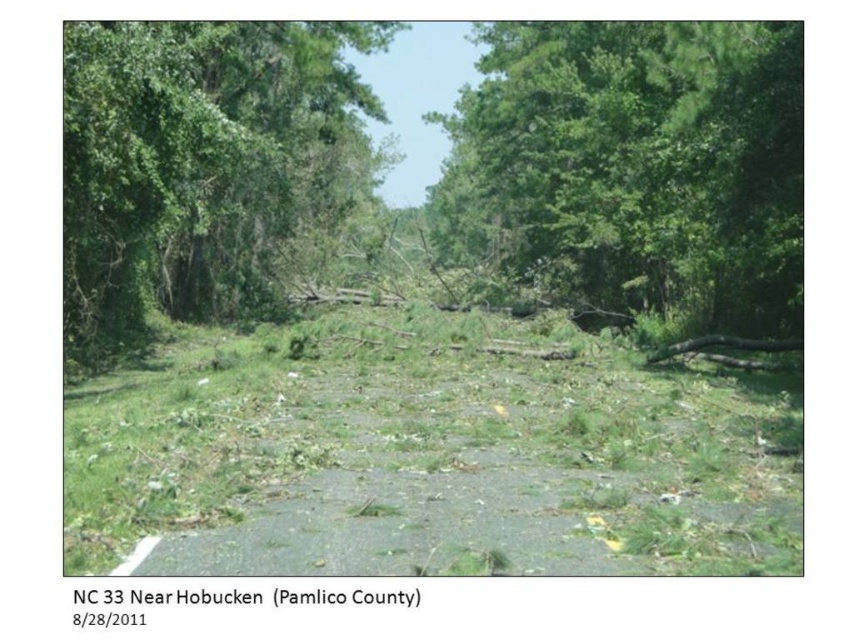
Question: Can you confirm if green leafy tree at center is bigger than green leafy tree at left?

Choices:
 (A) no
 (B) yes

Answer: (B)

Question: Which object appears farthest from the camera in this image?

Choices:
 (A) green leafy tree at center
 (B) green leafy trees at center

Answer: (A)

Question: Which point is farther from the camera taking this photo?

Choices:
 (A) (460, 113)
 (B) (65, 316)

Answer: (A)

Question: Can you confirm if green leafy trees at center is bigger than green leafy tree at center?

Choices:
 (A) no
 (B) yes

Answer: (B)

Question: Can you confirm if green leafy tree at center is smaller than green leafy tree at left?

Choices:
 (A) no
 (B) yes

Answer: (A)

Question: Which point is closer to the camera?

Choices:
 (A) (660, 284)
 (B) (265, 48)
 (C) (323, 300)

Answer: (B)